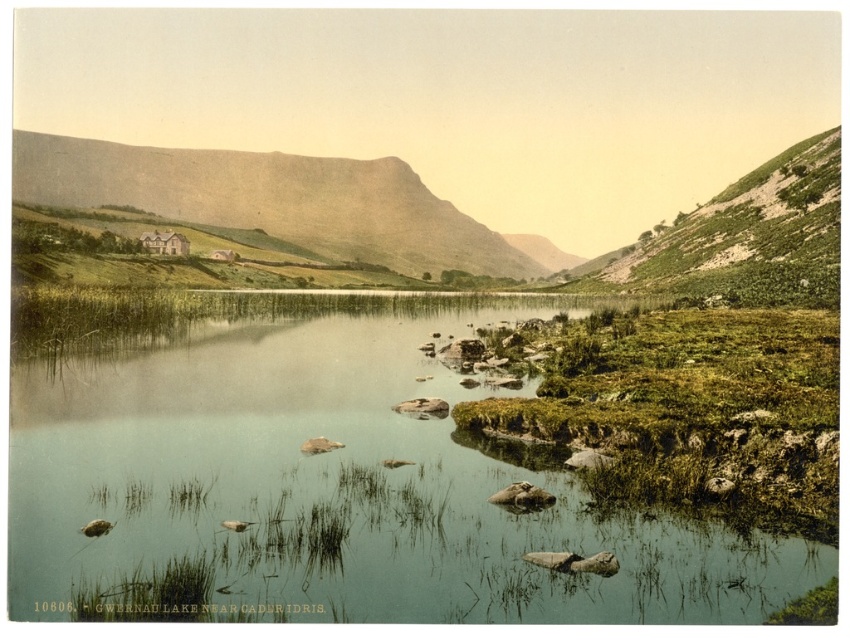
You are standing at the edge of the lake and see two points in the scene. The first point is at coordinates point (81, 582) and the second is at point (350, 234). Which point is closer to you?

Point (81, 582) is closer to the viewer than point (350, 234).

Consider the image. You are standing at the edge of the green grassy river at center and want to walk towards the smooth beige mountain at center. Which direction should you head?

You should head to the left because the green grassy river at center is to the right of the smooth beige mountain at center, so moving left will take you towards the mountain.